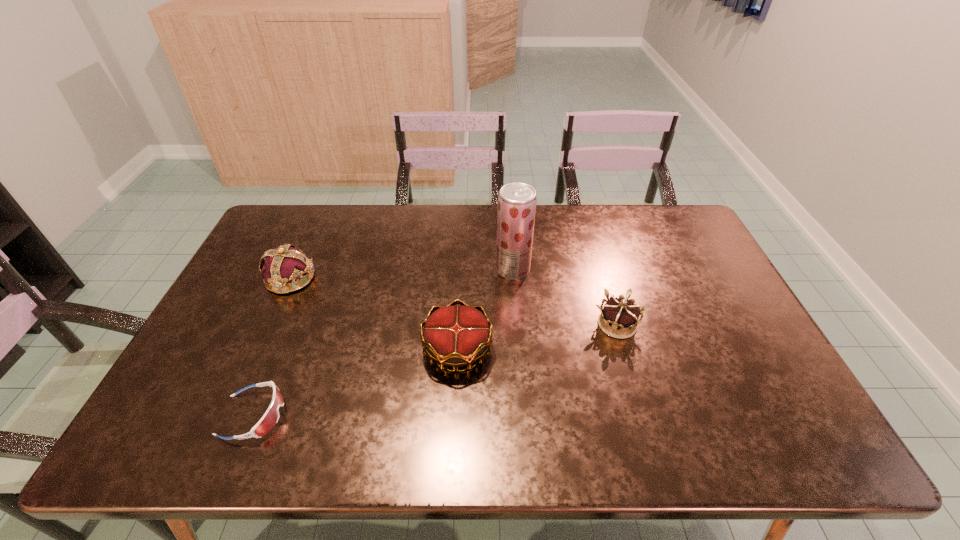
Find the location of a particular element. The width and height of the screenshot is (960, 540). free space at the right edge of the desktop is located at coordinates (677, 257).

Where is `vacant space at the near left corner`? vacant space at the near left corner is located at coordinates (211, 428).

The width and height of the screenshot is (960, 540). Identify the location of free space at the far right corner of the desktop. (664, 242).

You are a GUI agent. You are given a task and a screenshot of the screen. Output one action in this format:
    pyautogui.click(x=<x>, y=<y>)
    Task: Click on the unoccupied area between the rightmost crown and the second crown from left to right
    Image resolution: width=960 pixels, height=540 pixels.
    Given the screenshot: What is the action you would take?
    pyautogui.click(x=538, y=337)

Where is `blank region between the rightmost object and the second crown from right to left`? The width and height of the screenshot is (960, 540). blank region between the rightmost object and the second crown from right to left is located at coordinates (538, 337).

Where is `free point between the rightmost object and the third object from left to right`? This screenshot has height=540, width=960. free point between the rightmost object and the third object from left to right is located at coordinates (538, 337).

Find the location of a particular element. The height and width of the screenshot is (540, 960). vacant space in between the second object from right to left and the rightmost object is located at coordinates (564, 297).

This screenshot has width=960, height=540. I want to click on blank region between the second object from right to left and the third object from left to right, so click(485, 309).

Where is `empty space between the second crown from left to right and the rightmost crown`? empty space between the second crown from left to right and the rightmost crown is located at coordinates (538, 337).

What are the coordinates of `vacant space that's between the second tallest object and the tallest object` in the screenshot? It's located at (401, 274).